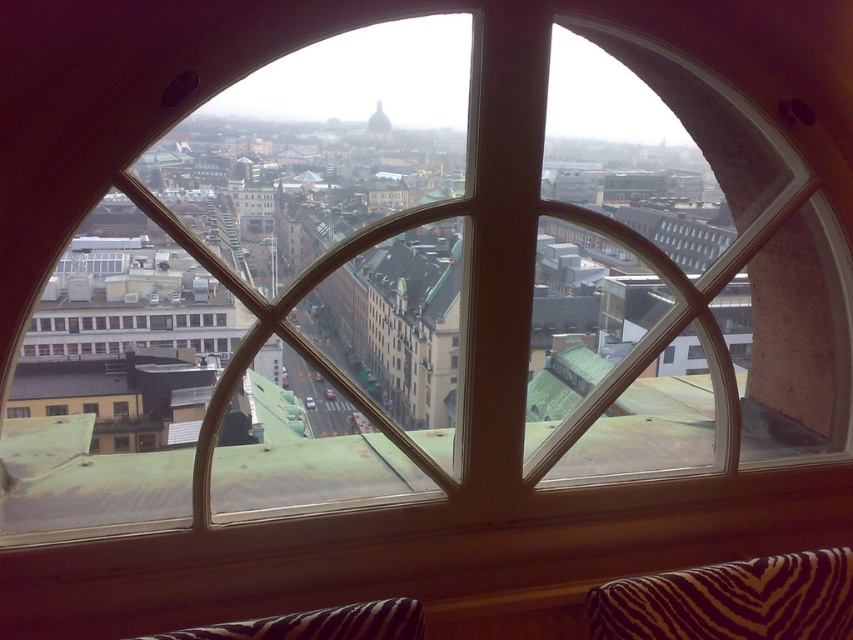
Can you confirm if zebra print fabric pillow at lower right is shorter than transparent glass window at center?

In fact, zebra print fabric pillow at lower right may be taller than transparent glass window at center.

The image size is (853, 640). What do you see at coordinates (730, 600) in the screenshot?
I see `zebra print fabric pillow at lower right` at bounding box center [730, 600].

Identify the location of zebra print fabric pillow at lower right. (730, 600).

Locate an element on the screen. zebra print fabric pillow at lower center is located at coordinates (318, 624).

You are a GUI agent. You are given a task and a screenshot of the screen. Output one action in this format:
    pyautogui.click(x=<x>, y=<y>)
    Task: Click on the zebra print fabric pillow at lower center
    The width and height of the screenshot is (853, 640).
    Given the screenshot: What is the action you would take?
    pyautogui.click(x=318, y=624)

Between zebra print fabric pillow at lower right and zebra print fabric pillow at lower center, which one appears on the right side from the viewer's perspective?

Positioned to the right is zebra print fabric pillow at lower right.

Who is more forward, (798, 593) or (289, 620)?

Positioned in front is point (289, 620).

This screenshot has width=853, height=640. Identify the location of zebra print fabric pillow at lower right. (730, 600).